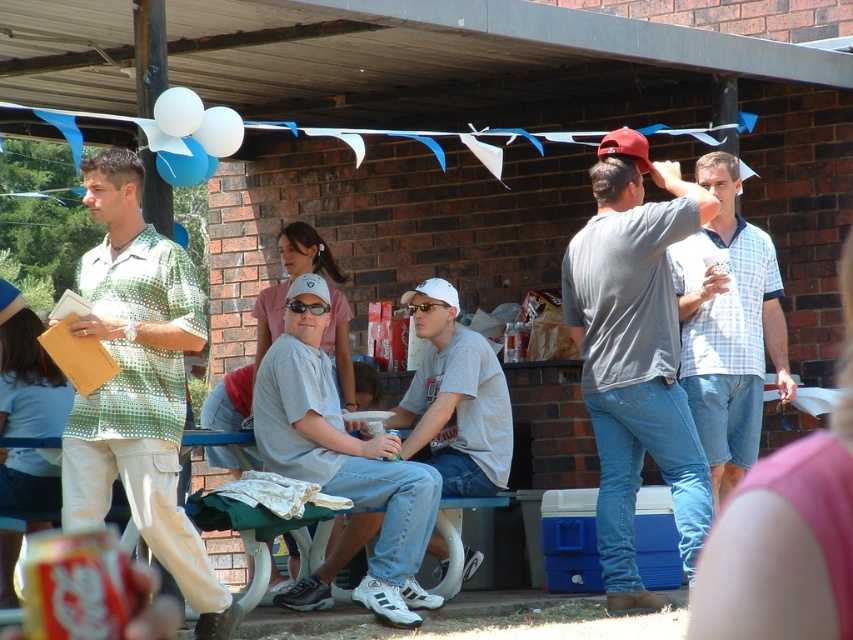
You are organizing a photo shoot and need to position two models wearing the light blue plaid shirt at center and the gray matte shirt at center. Based on their current positions in the scene, which model should you move to make more room for both to stand comfortably?

The light blue plaid shirt at center occupies less space than the gray matte shirt at center, so you should move the gray matte shirt at center to create more space.